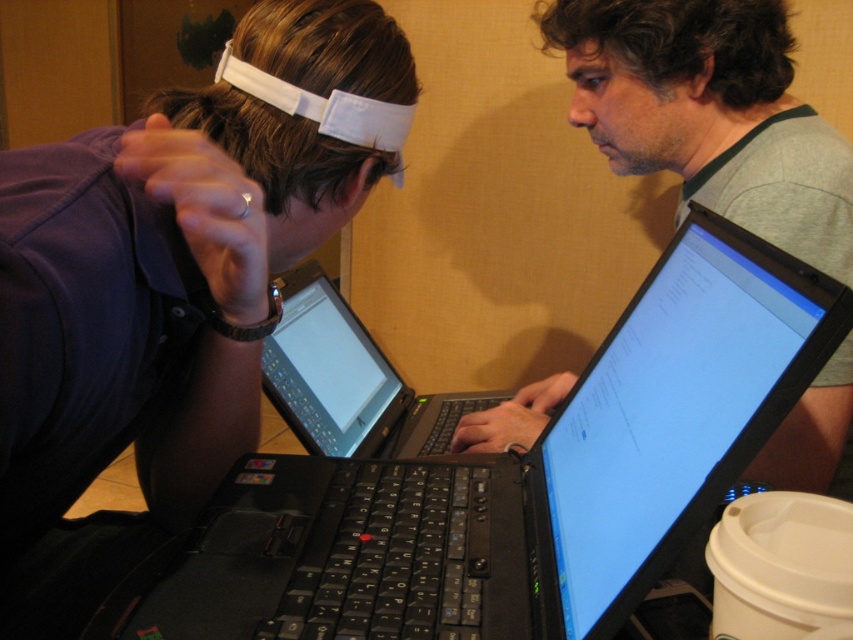
You are a delivery person who needs to place a small package on the desk without blocking the view of the black matte laptop at center. Given that the package is 10 inches wide, can you position it safely?

The black matte laptop at center is 15.60 inches away from the viewer. Since the package is only 10 inches wide, you can place it safely on the desk without obstructing the laptop as long as you position it at least 15.60 inches away from your current viewpoint.